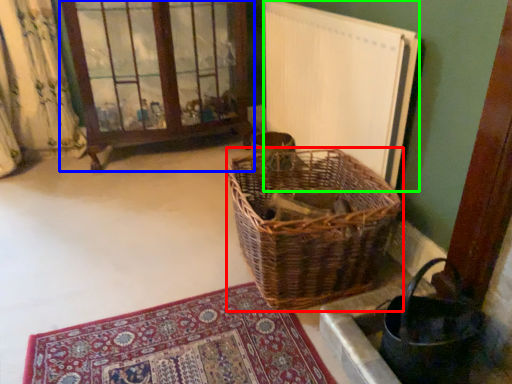
Question: Considering the real-world distances, which object is closest to picnic basket (highlighted by a red box)? window frame (highlighted by a blue box) or radiator (highlighted by a green box).

Choices:
 (A) window frame
 (B) radiator

Answer: (B)